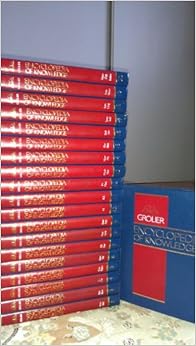
This screenshot has width=196, height=346. What are the coordinates of `blue trim on book spine` in the screenshot? It's located at (117, 171), (115, 234), (114, 277), (121, 121).